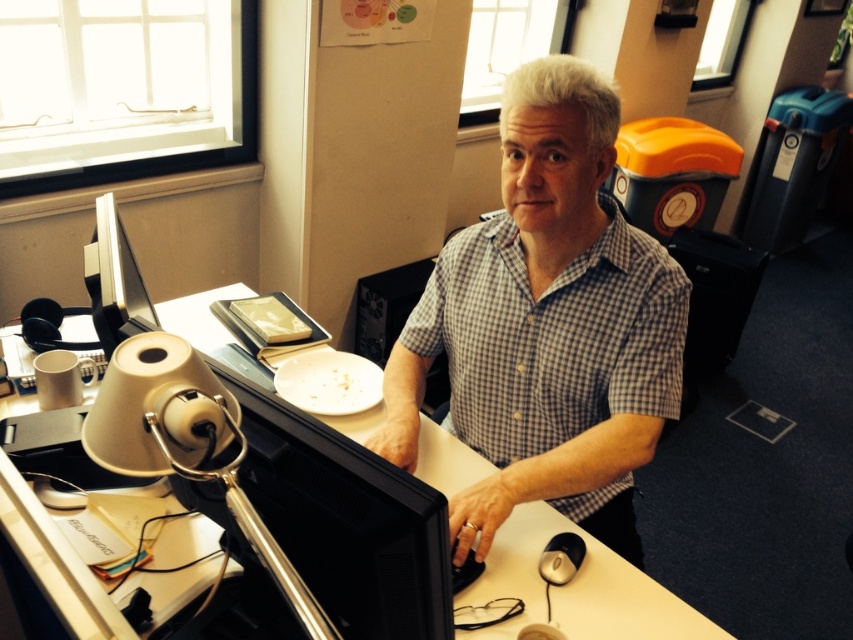
Question: Is satin black monitor at left to the right of black plastic mouse at lower center from the viewer's perspective?

Choices:
 (A) no
 (B) yes

Answer: (A)

Question: Which point is farther from the camera taking this photo?

Choices:
 (A) (515, 582)
 (B) (392, 401)

Answer: (B)

Question: In this image, where is checkered fabric shirt at center located relative to satin black monitor at left?

Choices:
 (A) left
 (B) right

Answer: (B)

Question: Which point appears farthest from the camera in this image?

Choices:
 (A) (96, 275)
 (B) (569, 140)
 (C) (537, 525)

Answer: (C)

Question: Which of the following is the closest to the observer?

Choices:
 (A) checkered fabric shirt at center
 (B) black plastic mouse at lower center
 (C) white plastic table at center

Answer: (A)

Question: Can you confirm if satin black monitor at left is thinner than black plastic mouse at lower center?

Choices:
 (A) yes
 (B) no

Answer: (B)